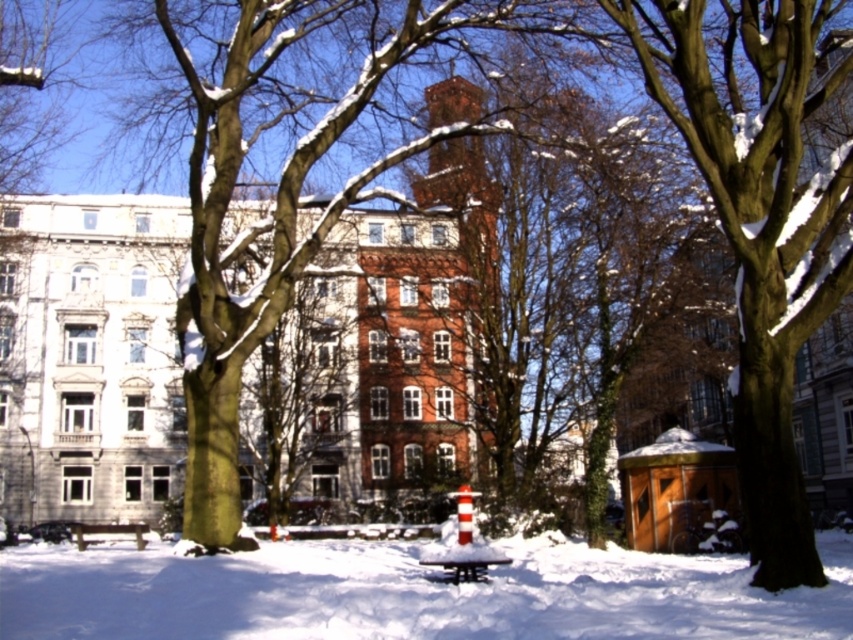
Does white fluffy snow at center lie in front of wooden park bench at center?

Yes, white fluffy snow at center is closer to the viewer.

Measure the distance from white fluffy snow at center to wooden park bench at center.

white fluffy snow at center is 19.57 meters from wooden park bench at center.

Who is more distant from viewer, (421, 621) or (428, 563)?

Point (428, 563)

The height and width of the screenshot is (640, 853). Identify the location of white fluffy snow at center. (408, 593).